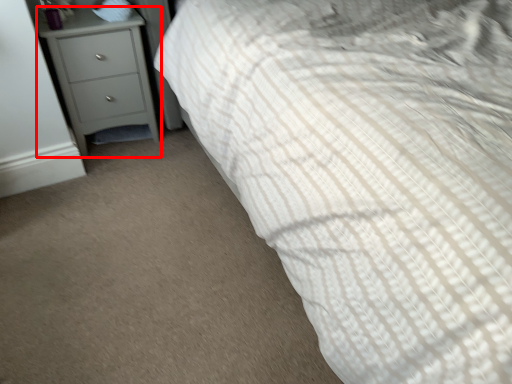
Question: From the image's perspective, where is chest of drawers (annotated by the red box) located relative to pillow?

Choices:
 (A) above
 (B) below

Answer: (B)